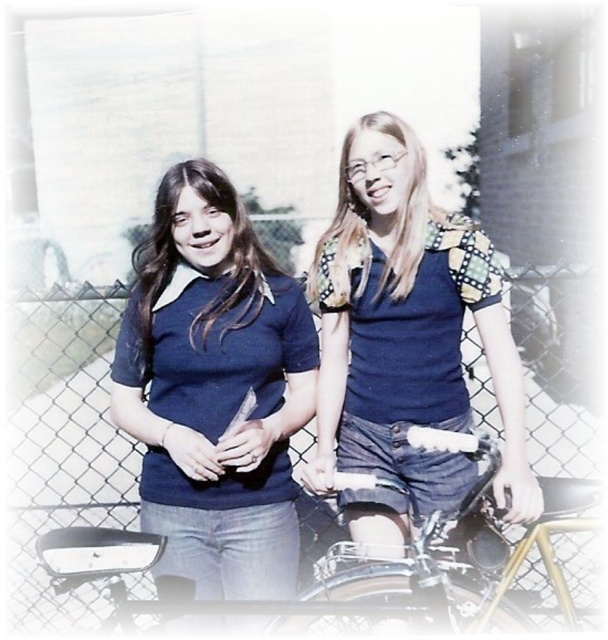
Question: Which object is closer to the camera taking this photo?

Choices:
 (A) blue denim shorts at center
 (B) metallic chain-link fence at center

Answer: (A)

Question: Based on their relative distances, which object is farther from the matte blue sweater at center?

Choices:
 (A) metallic chain-link fence at center
 (B) matte blue sweater at left

Answer: (A)

Question: Is metallic chain-link fence at center positioned in front of matte blue sweater at left?

Choices:
 (A) yes
 (B) no

Answer: (B)

Question: Which of the following is the farthest from the observer?

Choices:
 (A) matte blue sweater at left
 (B) matte blue sweater at center
 (C) blue denim shorts at center

Answer: (A)

Question: Is metallic chain-link fence at center positioned in front of matte blue sweater at left?

Choices:
 (A) no
 (B) yes

Answer: (A)

Question: Does metallic chain-link fence at center come in front of shiny metallic bicycle at lower center?

Choices:
 (A) no
 (B) yes

Answer: (A)